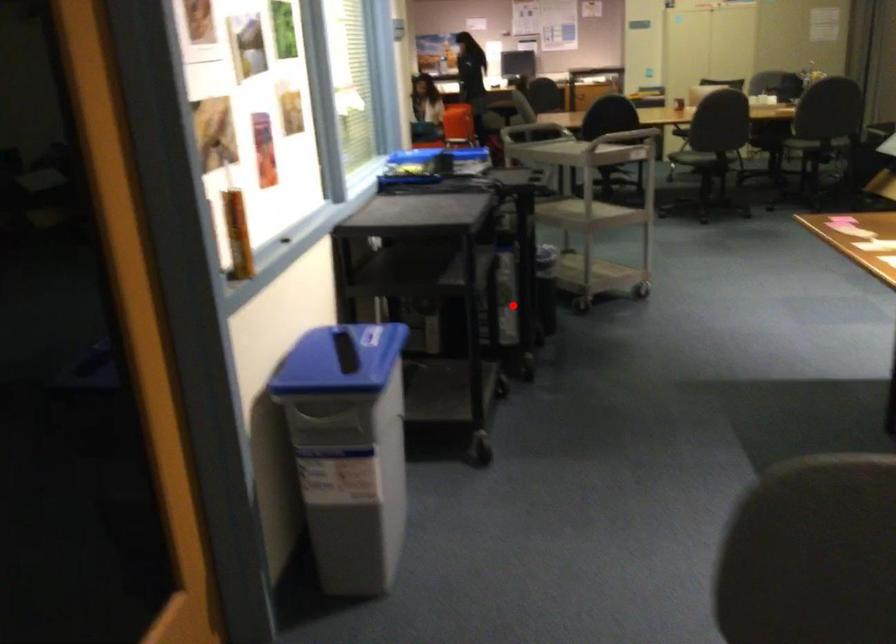
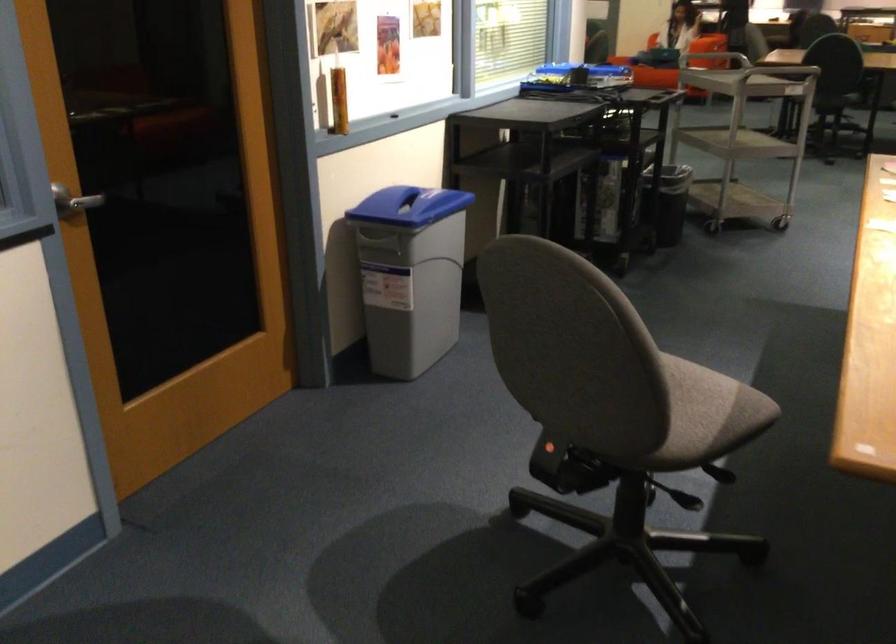
Question: I am providing you with two images of the same scene from different viewpoints. Image1 has a red point marked. In image2, the corresponding 3D location appears at what relative position? Reply with the corresponding letter.

Choices:
 (A) Closer
 (B) Farther

Answer: (B)